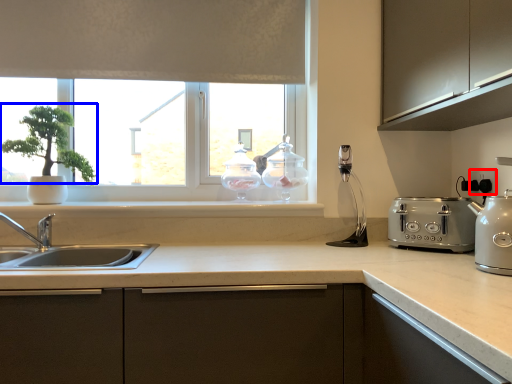
Question: Which object appears farthest to the camera in this image, electric outlet (highlighted by a red box) or plant (highlighted by a blue box)?

Choices:
 (A) electric outlet
 (B) plant

Answer: (B)